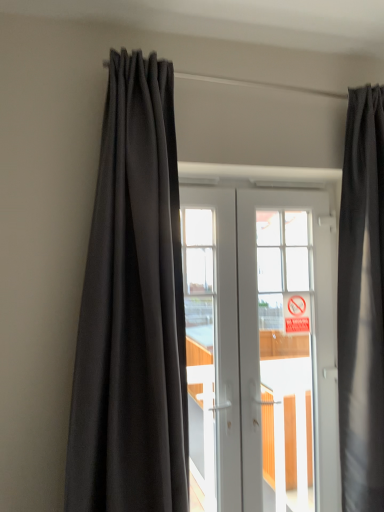
Question: From a real-world perspective, is red plastic sign at center positioned above or below dark gray fabric curtain at left, which is counted as the second curtain, starting from the right?

Choices:
 (A) above
 (B) below

Answer: (B)

Question: In terms of height, does red plastic sign at center look taller or shorter compared to dark gray fabric curtain at left, which is counted as the second curtain, starting from the right?

Choices:
 (A) tall
 (B) short

Answer: (B)

Question: Which is farther from the matte black curtain at upper right, acting as the 2th curtain starting from the left?

Choices:
 (A) white glossy door at center
 (B) red plastic sign at center
 (C) dark gray fabric curtain at left, which is the 1th curtain from left to right

Answer: (C)

Question: Considering the real-world distances, which object is farthest from the red plastic sign at center?

Choices:
 (A) white glossy door at center
 (B) dark gray fabric curtain at left, which is counted as the second curtain, starting from the right
 (C) matte black curtain at upper right, which appears as the 1th curtain when viewed from the right

Answer: (B)